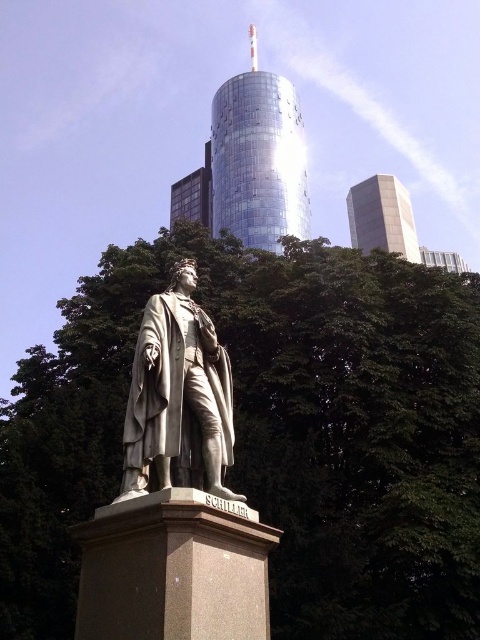
How much distance is there between gray stone statue at center and white glass tower at upper right?

The distance of gray stone statue at center from white glass tower at upper right is 496.92 feet.

Is gray stone statue at center thinner than white glass tower at upper right?

Correct, gray stone statue at center's width is less than white glass tower at upper right's.

Which is behind, point (145, 440) or point (361, 202)?

The point (361, 202) is more distant.

Identify the location of gray stone statue at center. The image size is (480, 640). (178, 396).

Which is more to the right, green leafy tree at center or white glass tower at upper right?

From the viewer's perspective, white glass tower at upper right appears more on the right side.

Is point (59, 493) less distant than point (384, 250)?

That is True.

Identify the location of green leafy tree at center. This screenshot has width=480, height=640. (273, 433).

Does shiny glass tower at upper center have a lesser height compared to white glass tower at upper right?

No, shiny glass tower at upper center is not shorter than white glass tower at upper right.

Does shiny glass tower at upper center have a greater width compared to white glass tower at upper right?

Yes, shiny glass tower at upper center is wider than white glass tower at upper right.

Between point (273, 244) and point (381, 196), which one is positioned behind?

The point (381, 196) is behind.

The width and height of the screenshot is (480, 640). Find the location of `shiny glass tower at upper center`. shiny glass tower at upper center is located at coordinates (257, 160).